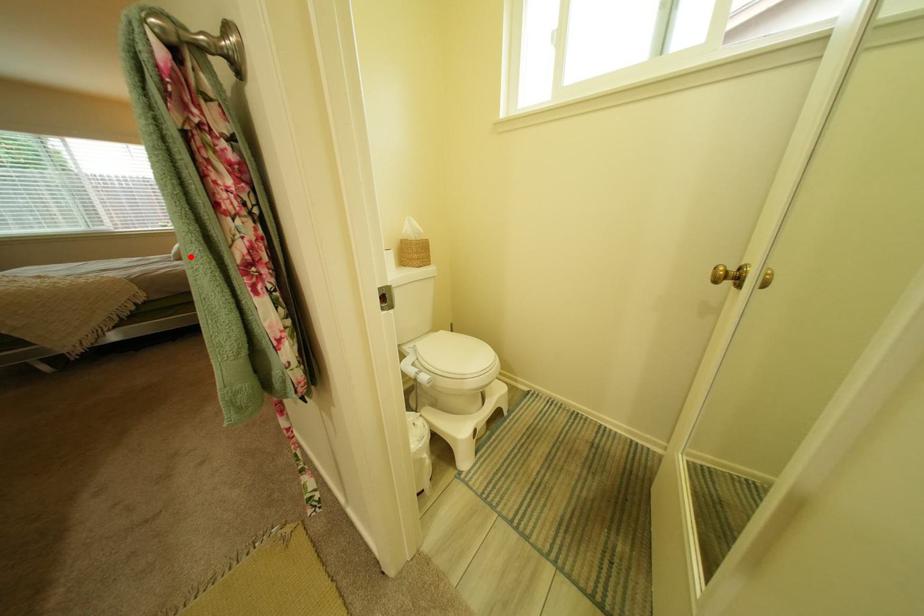
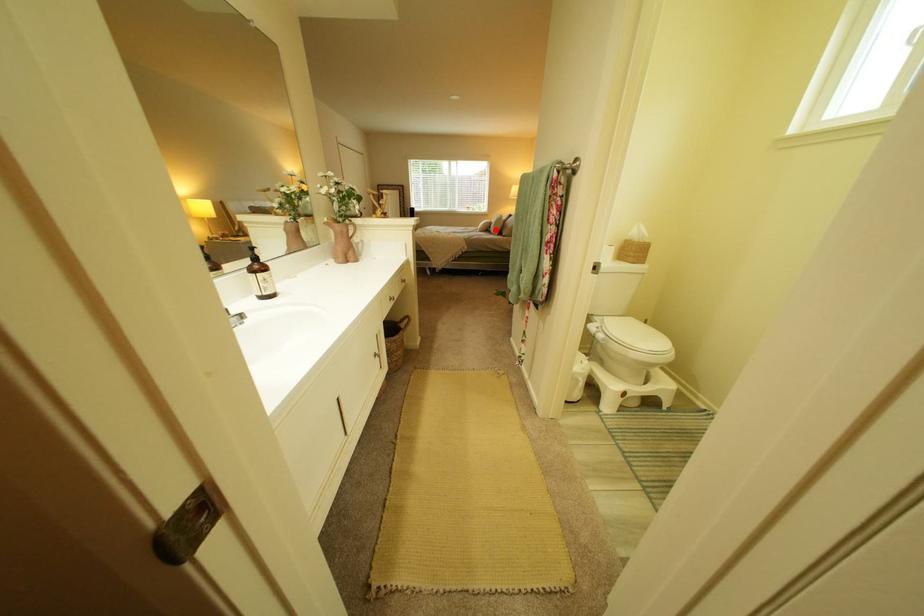
I am providing you with two images of the same scene from different viewpoints. A red point is marked on the first image and another point is marked on the second image. Do the highlighted points in image1 and image2 indicate the same real-world spot?

Yes